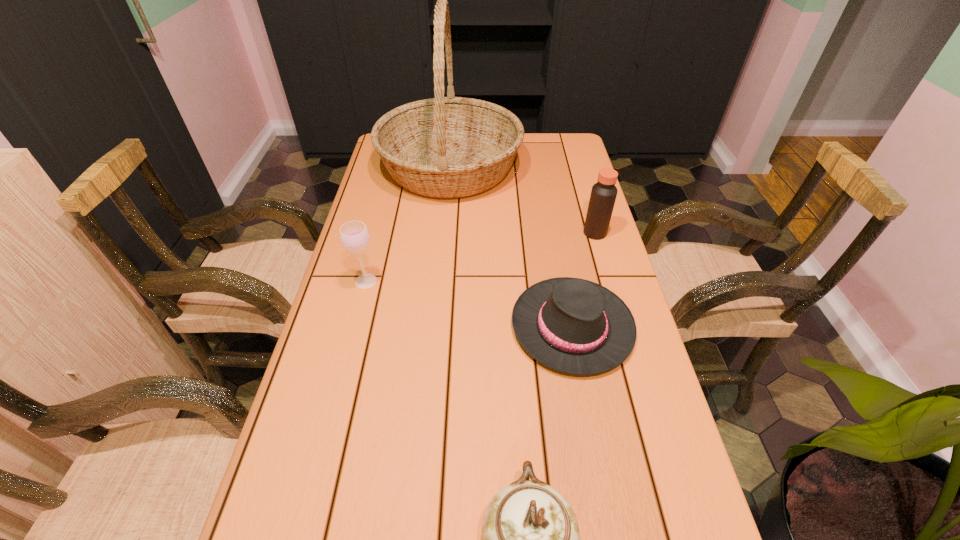
Locate an element on the screen. vacant point located between the shortest object and the tallest object is located at coordinates (511, 247).

In order to click on object that ranks as the fourth closest to the wineglass in this screenshot , I will do `click(603, 194)`.

Select which object is the third closest to the farthest object. Please provide its 2D coordinates. Your answer should be formatted as a tuple, i.e. [(x, y)], where the tuple contains the x and y coordinates of a point satisfying the conditions above.

[(575, 326)]

Locate an element on the screen. The height and width of the screenshot is (540, 960). free region that satisfies the following two spatial constraints: 1. on the back side of the shortest object; 2. on the right side of the vinegar is located at coordinates (555, 233).